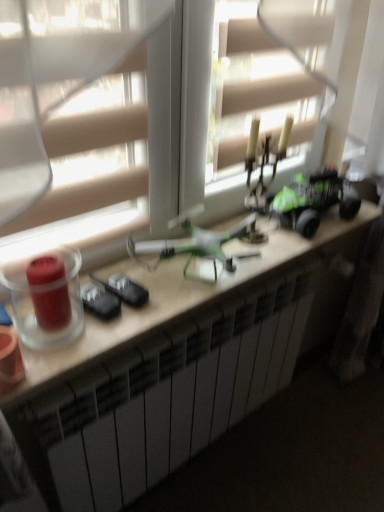
Question: Does transparent glass candle at left, arranged as the 1th candle holder when viewed from the left, have a lesser width compared to white matte desk at center?

Choices:
 (A) no
 (B) yes

Answer: (B)

Question: Can you confirm if transparent glass candle at left, arranged as the 1th candle holder when viewed from the left, is taller than white matte desk at center?

Choices:
 (A) yes
 (B) no

Answer: (B)

Question: Is transparent glass candle at left, arranged as the 1th candle holder when viewed from the left, positioned with its back to white matte desk at center?

Choices:
 (A) no
 (B) yes

Answer: (A)

Question: Is transparent glass candle at left, the second candle holder positioned from the right, surrounding white matte desk at center?

Choices:
 (A) yes
 (B) no

Answer: (B)

Question: Can you confirm if transparent glass candle at left, arranged as the 1th candle holder when viewed from the left, is positioned to the left of white matte desk at center?

Choices:
 (A) no
 (B) yes

Answer: (B)

Question: Considering the positions of white matte desk at center and transparent glass candle at left, arranged as the 1th candle holder when viewed from the left, in the image, is white matte desk at center bigger or smaller than transparent glass candle at left, arranged as the 1th candle holder when viewed from the left,?

Choices:
 (A) small
 (B) big

Answer: (B)

Question: From a real-world perspective, relative to transparent glass candle at left, the second candle holder positioned from the right, is white matte desk at center vertically above or below?

Choices:
 (A) below
 (B) above

Answer: (A)

Question: From the image's perspective, relative to transparent glass candle at left, arranged as the 1th candle holder when viewed from the left, is white matte desk at center above or below?

Choices:
 (A) below
 (B) above

Answer: (A)

Question: In the image, is white matte desk at center positioned in front of or behind transparent glass candle at left, arranged as the 1th candle holder when viewed from the left?

Choices:
 (A) behind
 (B) front

Answer: (A)

Question: From a real-world perspective, is green matte toy car at right above or below transparent plastic window at center?

Choices:
 (A) below
 (B) above

Answer: (A)

Question: From the image's perspective, is green matte toy car at right located above or below transparent plastic window at center?

Choices:
 (A) above
 (B) below

Answer: (B)

Question: Is green matte toy car at right inside the boundaries of transparent plastic window at center, or outside?

Choices:
 (A) outside
 (B) inside

Answer: (A)

Question: Is green matte toy car at right wider or thinner than transparent plastic window at center?

Choices:
 (A) thin
 (B) wide

Answer: (B)

Question: Is transparent glass candle at left, the second candle holder positioned from the right, taller or shorter than white matte desk at center?

Choices:
 (A) tall
 (B) short

Answer: (B)

Question: Is transparent glass candle at left, arranged as the 1th candle holder when viewed from the left, in front of or behind white matte desk at center in the image?

Choices:
 (A) behind
 (B) front

Answer: (B)